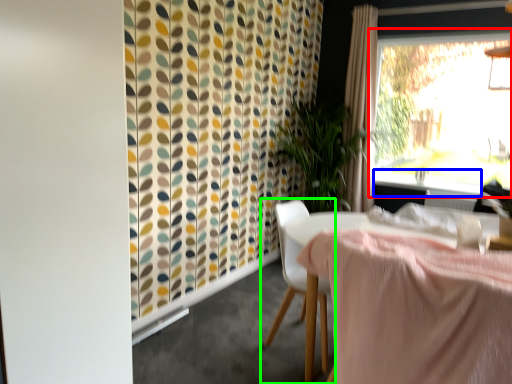
Question: Which is farther away from window (highlighted by a red box)? window sill (highlighted by a blue box) or chair (highlighted by a green box)?

Choices:
 (A) window sill
 (B) chair

Answer: (B)